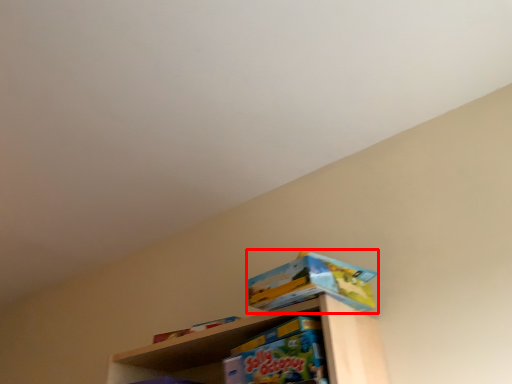
Question: Considering the relative positions of toy (annotated by the red box) and toy in the image provided, where is toy (annotated by the red box) located with respect to the staircase?

Choices:
 (A) left
 (B) right

Answer: (B)